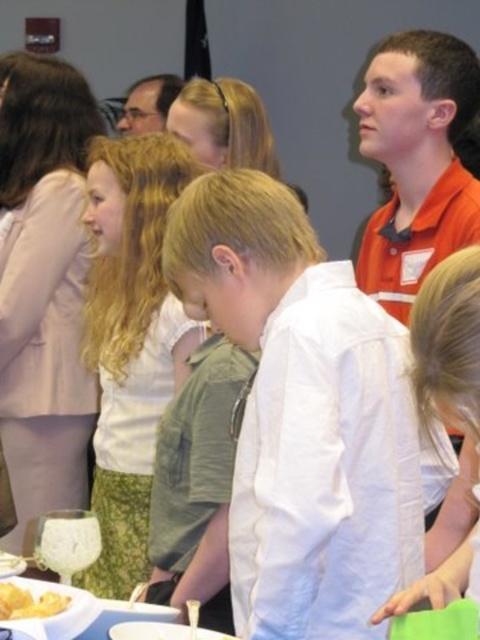
You are a delivery robot with a 12 inch wide package. You need to move from your current position to the white matte platter at lower left. There is an obstacle in the form of the white cotton shirt at center. Can you navigate around the obstacle to reach the platter without hitting it?

The distance between the white cotton shirt at center and the white matte platter at lower left is 22.80 inches. Since your package is 12 inches wide, you can navigate around the obstacle as there is sufficient space between them.

You are a photographer positioned at the back of the room. You need to take a photo that includes both the white cotton shirt at center and the white matte platter at lower left. Will the platter be fully visible in the photo if you focus on the shirt?

The white cotton shirt at center is taller than the white matte platter at lower left. Since the shirt is taller, focusing on it might block part of the platter, so the platter may not be fully visible unless adjusted.